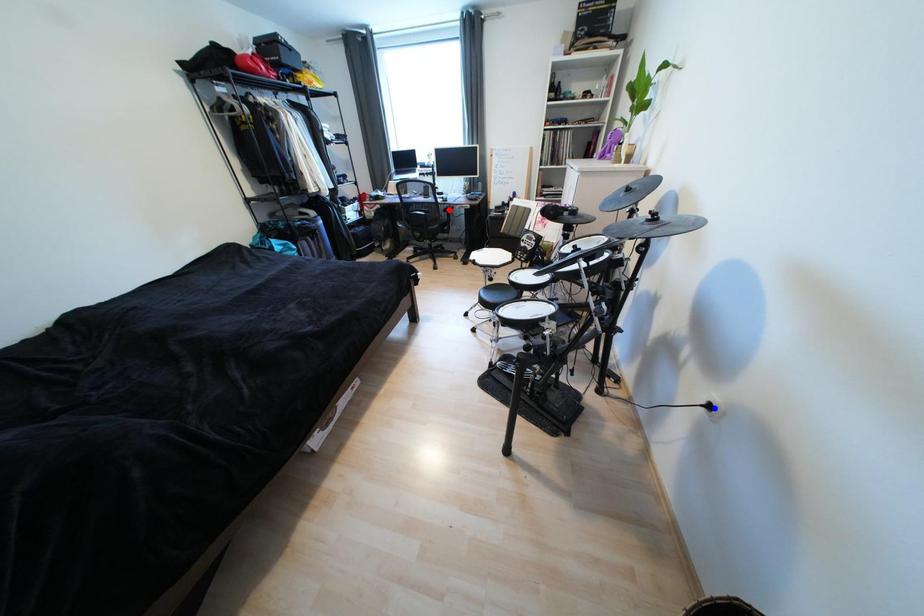
Question: In the image, two points are highlighted. Which point is nearer to the camera? Reply with the corresponding letter.

Choices:
 (A) blue point
 (B) red point

Answer: (A)